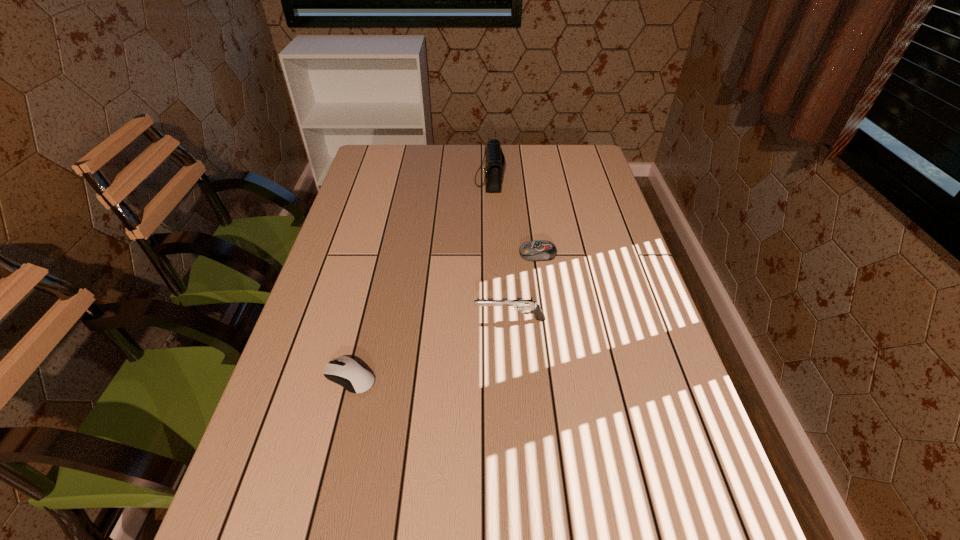
You are a GUI agent. You are given a task and a screenshot of the screen. Output one action in this format:
    pyautogui.click(x=<x>, y=<y>)
    Task: Click on the free location located 0.330m on the front flap of the tallest object
    The image size is (960, 540).
    Given the screenshot: What is the action you would take?
    pyautogui.click(x=375, y=180)

In order to click on vacant position located 0.100m on the front-facing side of the third farthest object in this screenshot , I will do click(x=432, y=320).

At what (x,y) coordinates should I click in order to perform the action: click on vacant space located 0.110m on the front-facing side of the third farthest object. Please return your answer as a coordinate pair (x, y). The height and width of the screenshot is (540, 960). Looking at the image, I should click on (427, 320).

The height and width of the screenshot is (540, 960). I want to click on vacant space located 0.160m on the front-facing side of the third farthest object, so click(x=406, y=320).

The image size is (960, 540). I want to click on free space located 0.090m on the left of the leftmost object, so click(281, 377).

Image resolution: width=960 pixels, height=540 pixels. What are the coordinates of `free spot located on the wheel side of the farther computer mouse` in the screenshot? It's located at (394, 254).

Image resolution: width=960 pixels, height=540 pixels. I want to click on free space located on the wheel side of the farther computer mouse, so click(387, 254).

I want to click on vacant space positioned on the wheel side of the farther computer mouse, so click(397, 254).

Where is `object that is at the far edge`? The height and width of the screenshot is (540, 960). object that is at the far edge is located at coordinates (495, 161).

Find the location of a particular element. object that is at the left edge is located at coordinates (345, 371).